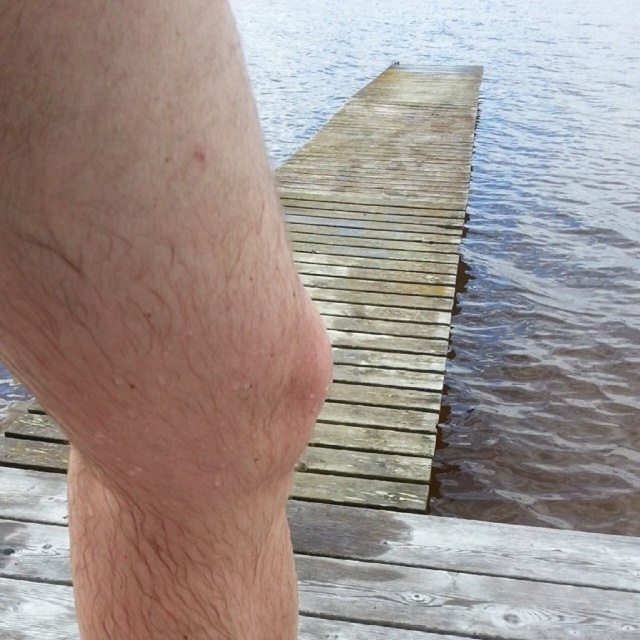
Does hairless skin at center have a greater width compared to brown wooden dock at center?

In fact, hairless skin at center might be narrower than brown wooden dock at center.

I want to click on hairless skin at center, so click(156, 310).